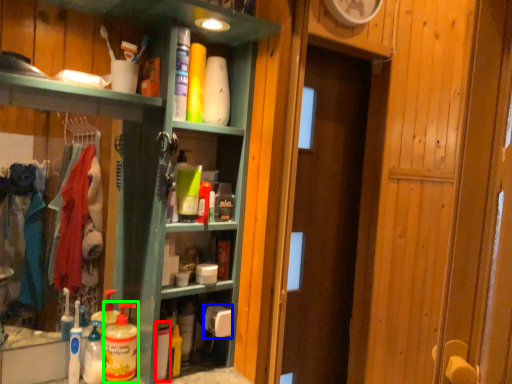
Question: Which is nearer to the cleaning product (highlighted by a red box)? toilet paper (highlighted by a blue box) or cleaning product (highlighted by a green box).

Choices:
 (A) toilet paper
 (B) cleaning product

Answer: (B)